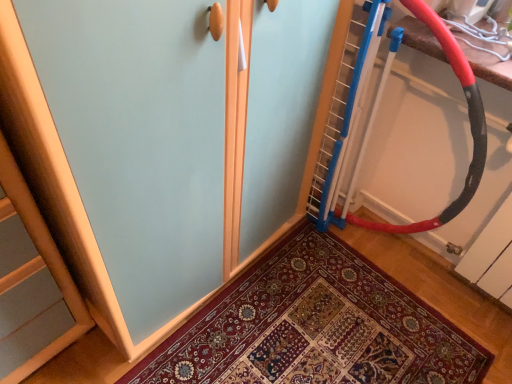
Locate an element on the screen. spots to the right of red rubber garden hose at right is located at coordinates (428, 274).